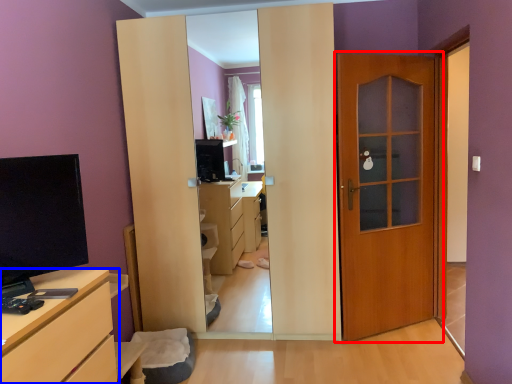
Question: Which of the following is the closest to the observer, door (highlighted by a red box) or chest of drawers (highlighted by a blue box)?

Choices:
 (A) door
 (B) chest of drawers

Answer: (B)